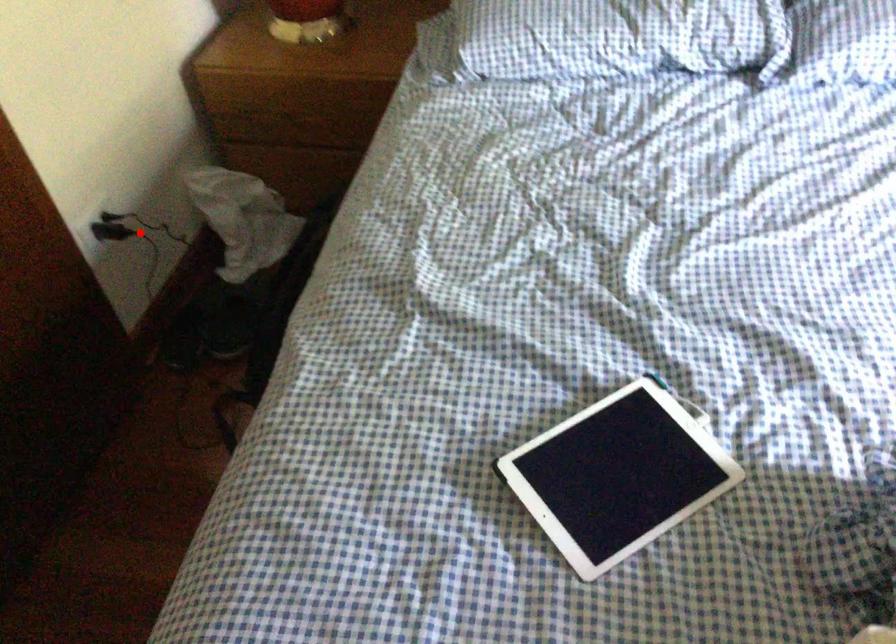
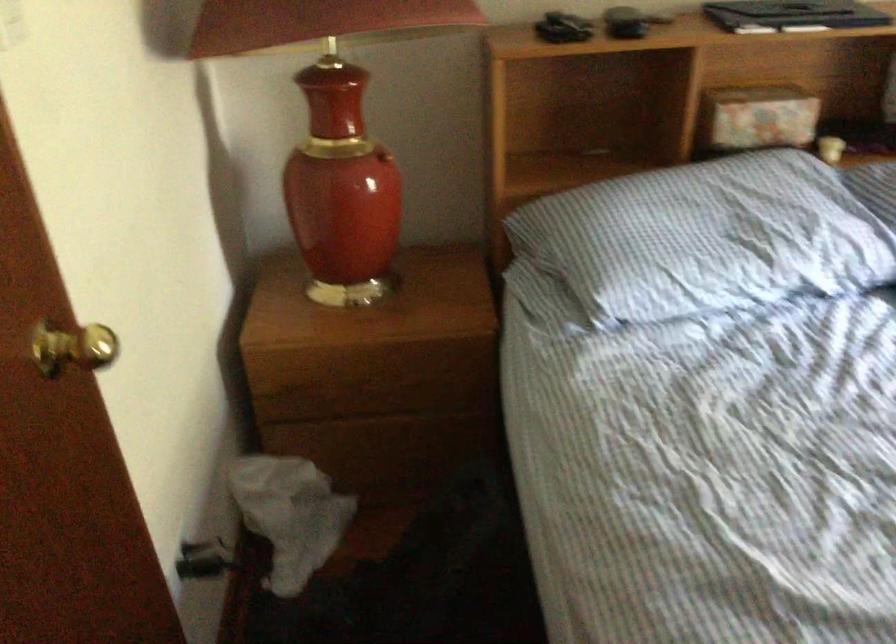
Question: I am providing you with two images of the same scene from different viewpoints. Image1 has a red point marked. In image2, the corresponding 3D location appears at what relative position? Reply with the corresponding letter.

Choices:
 (A) Closer
 (B) Farther

Answer: (A)